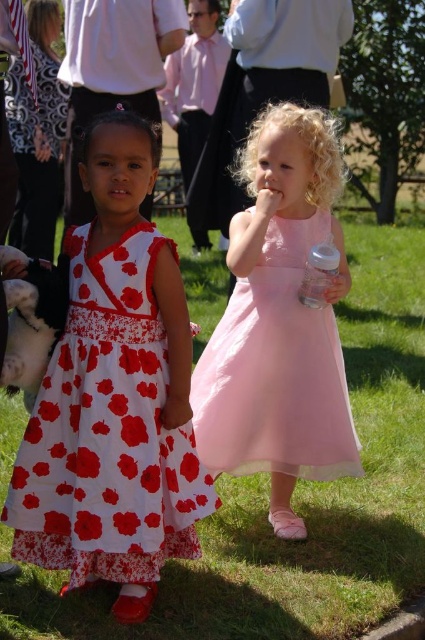
You are a photographer setting up a shot of the two girls. You want to ensure that the transparent plastic bottle at right is visible in the frame. Considering the height of the green grass at lower center, will the grass obscure the bottle?

The green grass at lower center is shorter than the transparent plastic bottle at right, so the grass will not obscure the bottle.

You are standing in the middle of the grassy area and want to place a small picnic basket. The basket needs to be placed exactly where the green grass at lower center is located. According to the coordinates provided, where should you place the basket?

The green grass at lower center is located at point (x=297, y=500), so you should place the picnic basket there.

You are a fashion designer observing two dresses in the image. The white floral dress at left and the pink tulle dress at center. Which dress has a larger size?

The white floral dress at left has a larger size compared to the pink tulle dress at center.